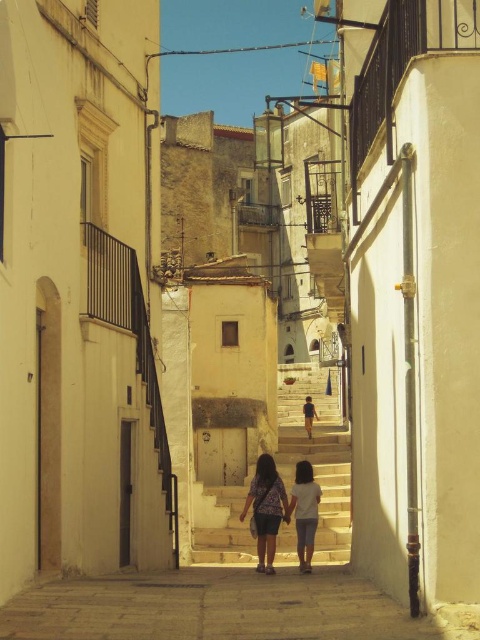
Which is above, light beige stone stairs at center or light blue denim jeans at center?

light beige stone stairs at center is above.

Can you confirm if light beige stone stairs at center is shorter than light blue denim jeans at center?

Incorrect, light beige stone stairs at center's height does not fall short of light blue denim jeans at center's.

Between point (312, 364) and point (292, 509), which one is positioned in front?

Point (292, 509) is in front.

You are a GUI agent. You are given a task and a screenshot of the screen. Output one action in this format:
    pyautogui.click(x=<x>, y=<y>)
    Task: Click on the light beige stone stairs at center
    
    Given the screenshot: What is the action you would take?
    pyautogui.click(x=316, y=452)

Is light beige stone stairs at center bigger than light blue denim shorts at center?

Yes, light beige stone stairs at center is bigger than light blue denim shorts at center.

Between light beige stone stairs at center and light blue denim shorts at center, which one appears on the left side from the viewer's perspective?

From the viewer's perspective, light beige stone stairs at center appears more on the left side.

Between point (295, 461) and point (313, 413), which one is positioned behind?

Point (313, 413)

The height and width of the screenshot is (640, 480). In order to click on light beige stone stairs at center in this screenshot , I will do `click(316, 452)`.

Who is more forward, (312, 474) or (312, 547)?

Point (312, 474) is more forward.

This screenshot has width=480, height=640. Identify the location of light brown fabric dress at center. (267, 509).

In order to click on light brown fabric dress at center in this screenshot , I will do `click(267, 509)`.

Where is `light brown fabric dress at center`? Image resolution: width=480 pixels, height=640 pixels. light brown fabric dress at center is located at coordinates (267, 509).